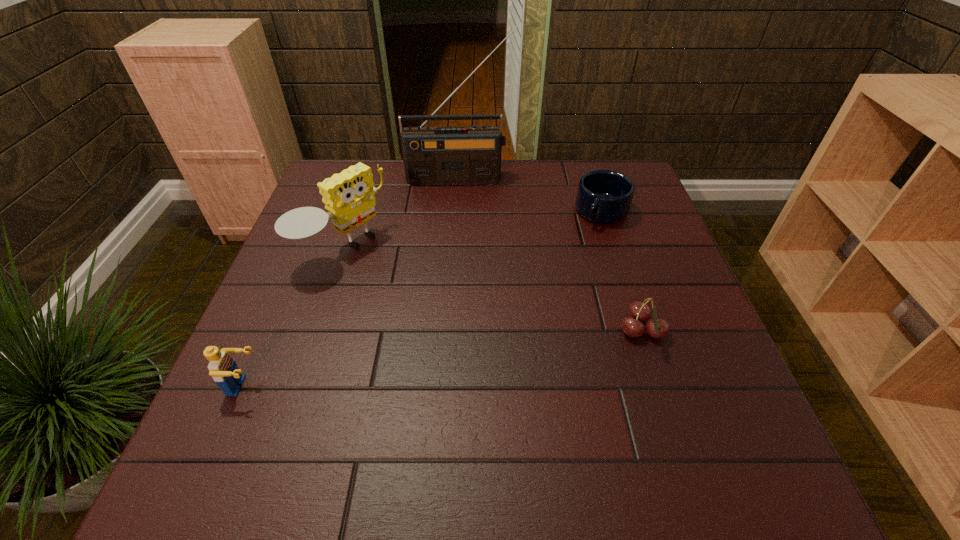
Where is `free spot on the desktop that is between the Lego and the second nearest object and is positioned with the handle on the side of the mug`? The height and width of the screenshot is (540, 960). free spot on the desktop that is between the Lego and the second nearest object and is positioned with the handle on the side of the mug is located at coordinates (509, 349).

Where is `vacant spot on the desktop that is between the third shortest object and the cherry and is positioned on the front-facing side of the second tallest object`? Image resolution: width=960 pixels, height=540 pixels. vacant spot on the desktop that is between the third shortest object and the cherry and is positioned on the front-facing side of the second tallest object is located at coordinates (494, 352).

Where is `vacant space on the desktop that is between the third shortest object and the fourth farthest object and is positioned on the front-facing side of the tallest object`? Image resolution: width=960 pixels, height=540 pixels. vacant space on the desktop that is between the third shortest object and the fourth farthest object and is positioned on the front-facing side of the tallest object is located at coordinates (458, 356).